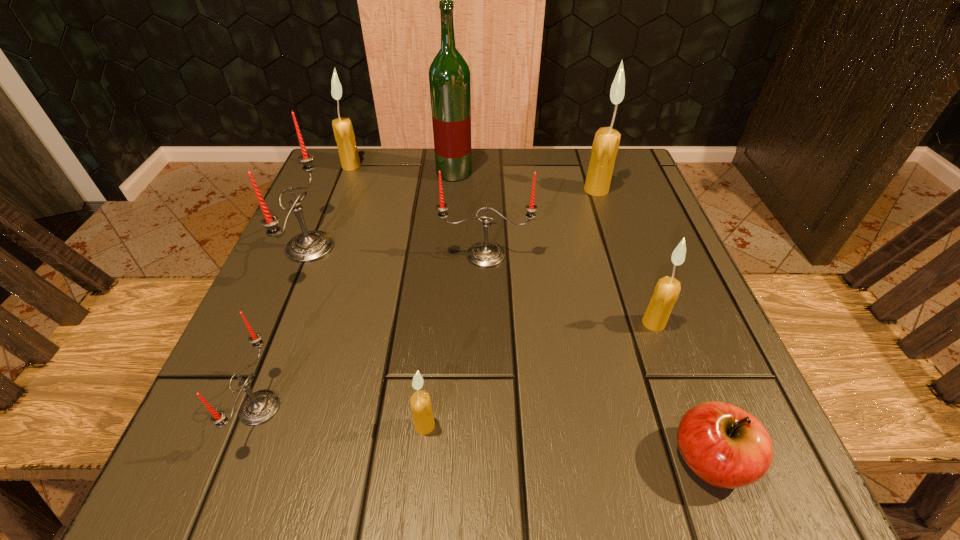
This screenshot has width=960, height=540. In the image, there is a desktop. Identify the location of vacant region at the far edge. (535, 152).

I want to click on free space at the near edge of the desktop, so click(x=570, y=464).

In order to click on free space at the left edge in this screenshot , I will do `click(351, 268)`.

Locate an element on the screen. This screenshot has height=540, width=960. free location at the right edge of the desktop is located at coordinates (628, 220).

Locate an element on the screen. Image resolution: width=960 pixels, height=540 pixels. free space at the far left corner is located at coordinates (372, 161).

Find the location of a particular element. This screenshot has width=960, height=540. vacant space at the near left corner of the desktop is located at coordinates (261, 446).

This screenshot has width=960, height=540. Find the location of `blank space at the near right corner of the desktop`. blank space at the near right corner of the desktop is located at coordinates (663, 442).

This screenshot has height=540, width=960. Find the location of `empty location between the shortest object and the fifth farthest candle`. empty location between the shortest object and the fifth farthest candle is located at coordinates (682, 391).

This screenshot has width=960, height=540. I want to click on vacant point located between the second biggest red candle and the second biggest cream candle, so click(419, 211).

The image size is (960, 540). I want to click on unoccupied position between the third cream candle from right to left and the nearest red candle, so click(343, 416).